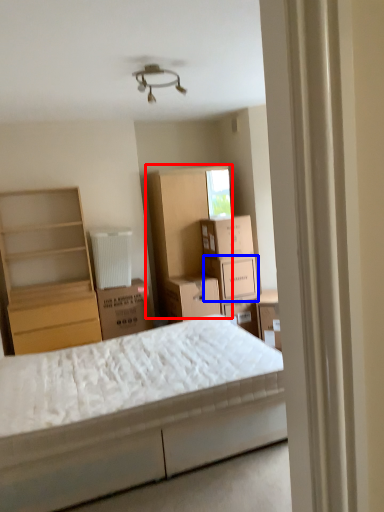
Question: Which object appears farthest to the camera in this image, cabinet (highlighted by a red box) or cardboard box (highlighted by a blue box)?

Choices:
 (A) cabinet
 (B) cardboard box

Answer: (A)